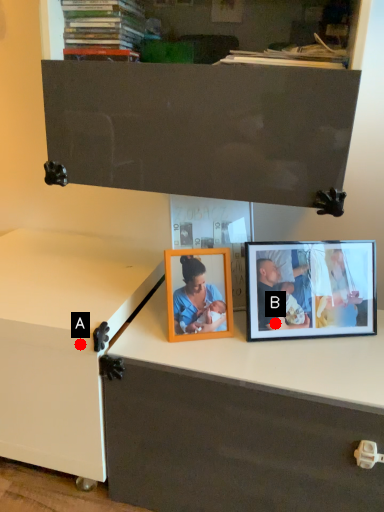
Question: Two points are circled on the image, labeled by A and B beside each circle. Which point is farther from the camera taking this photo?

Choices:
 (A) A is further
 (B) B is further

Answer: (B)